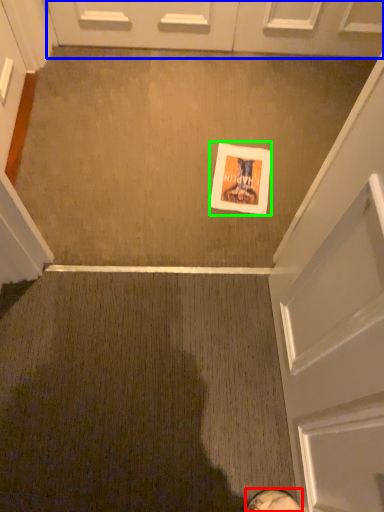
Question: Considering the real-world distances, which object is farthest from footwear (highlighted by a red box)? door (highlighted by a blue box) or flyer (highlighted by a green box)?

Choices:
 (A) door
 (B) flyer

Answer: (A)